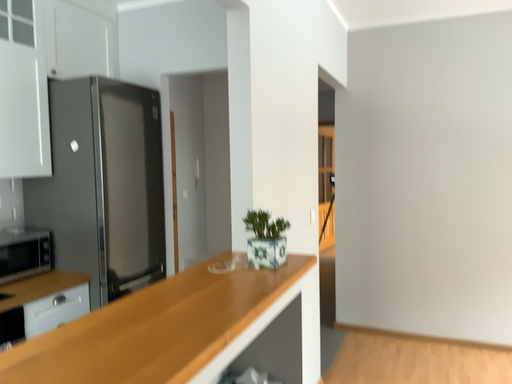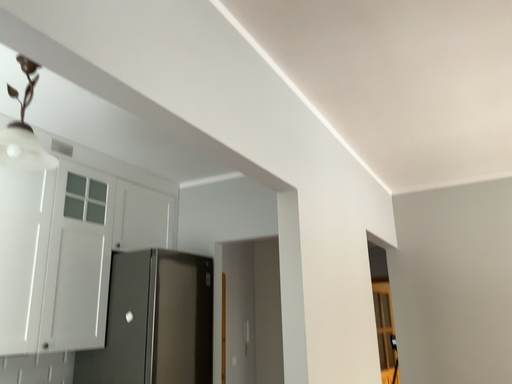
Question: How did the camera likely rotate when shooting the video?

Choices:
 (A) rotated upward
 (B) rotated downward

Answer: (A)